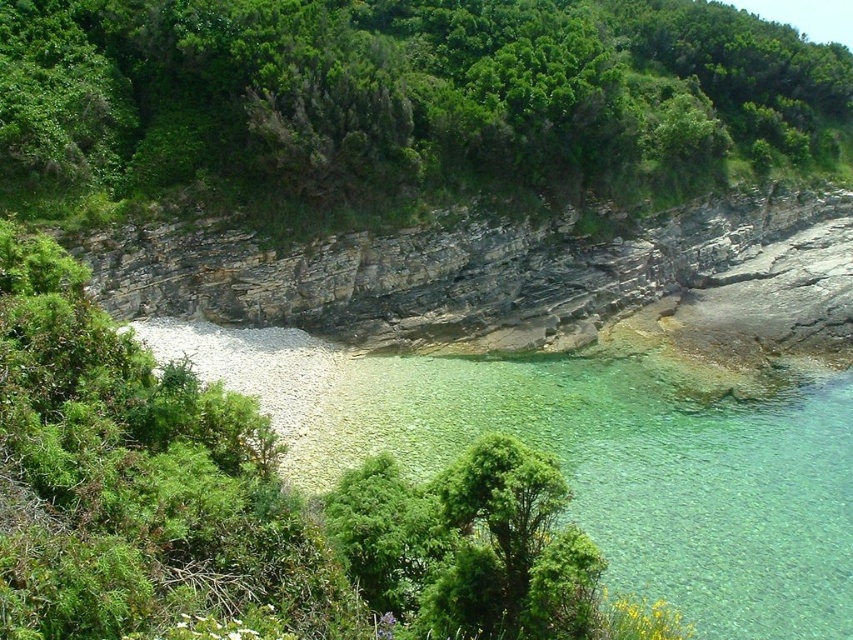
You are a hiker standing at the base of the rocky cliff at center. You notice a green leafy tree at upper center in the distance. Which object is taller?

The green leafy tree at upper center is much taller than the rocky cliff at center.

You are standing at the edge of the rocky cliff at center and want to reach the green leafy tree at upper center. In which direction should you move to get there?

You should move to the left to reach the green leafy tree at upper center since it is positioned to the left of the rocky cliff at center.